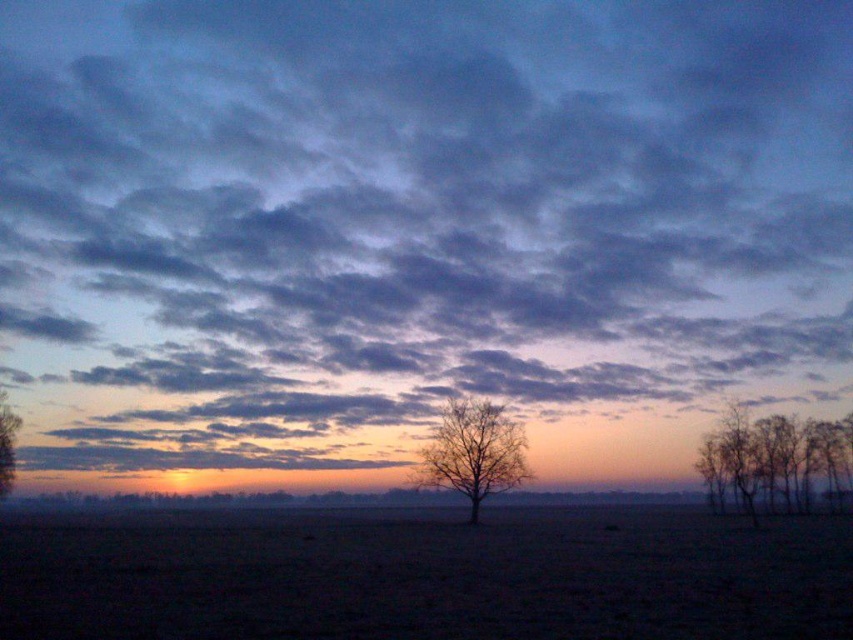
Question: In this image, where is bare branches at right located relative to bare branches at center?

Choices:
 (A) above
 (B) below

Answer: (B)

Question: Estimate the real-world distances between objects in this image. Which object is closer to the dark soil at center?

Choices:
 (A) bare branches at center
 (B) bare branches at right

Answer: (A)

Question: Which of the following is the closest to the observer?

Choices:
 (A) brown matte tree at left
 (B) dark soil at center
 (C) bare branches at right

Answer: (B)

Question: In this image, where is dark soil at center located relative to bare branches at center?

Choices:
 (A) left
 (B) right

Answer: (A)

Question: Among these points, which one is farthest from the camera?

Choices:
 (A) (704, 529)
 (B) (479, 460)

Answer: (B)

Question: Does bare branches at right have a greater width compared to bare branches at center?

Choices:
 (A) no
 (B) yes

Answer: (B)